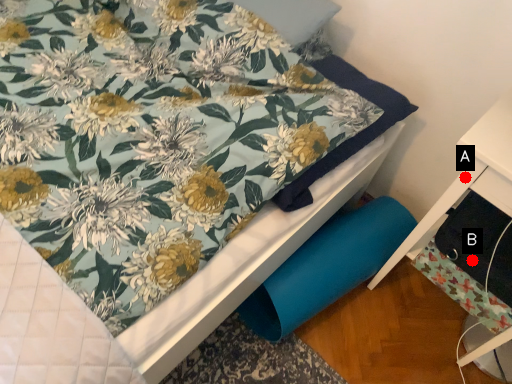
Question: Two points are circled on the image, labeled by A and B beside each circle. Which point appears closest to the camera in this image?

Choices:
 (A) A is closer
 (B) B is closer

Answer: (A)